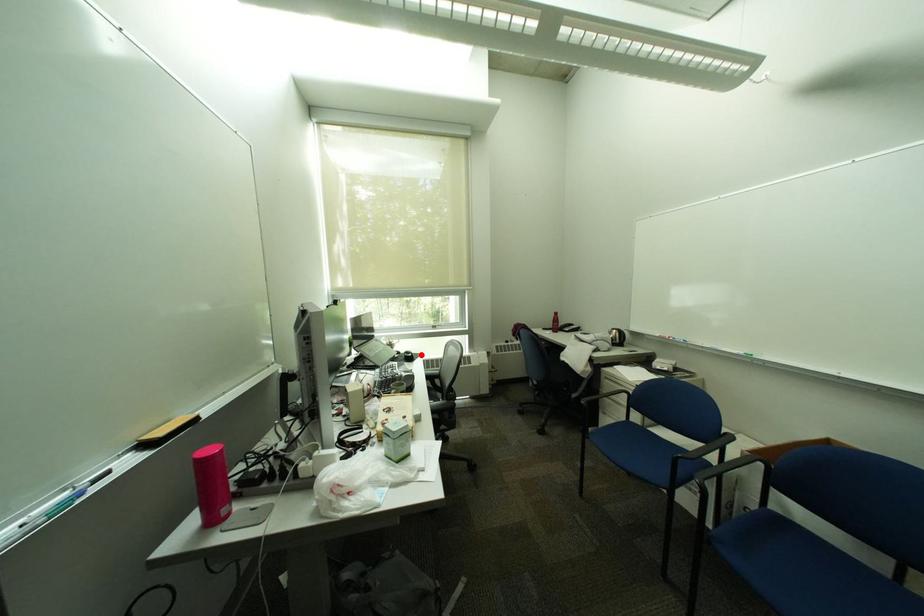
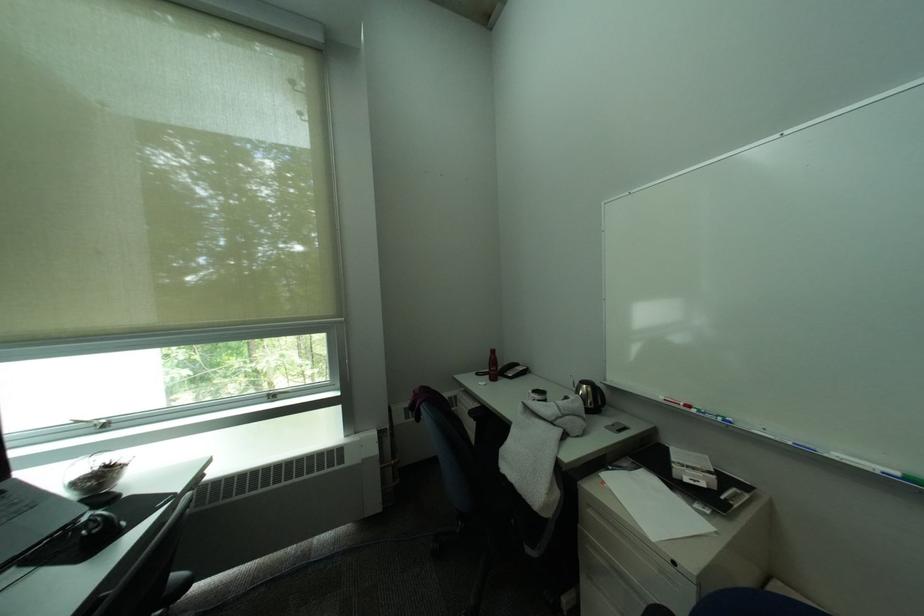
Where in the second image is the point corresponding to the highlighted location from the first image?

(106, 528)